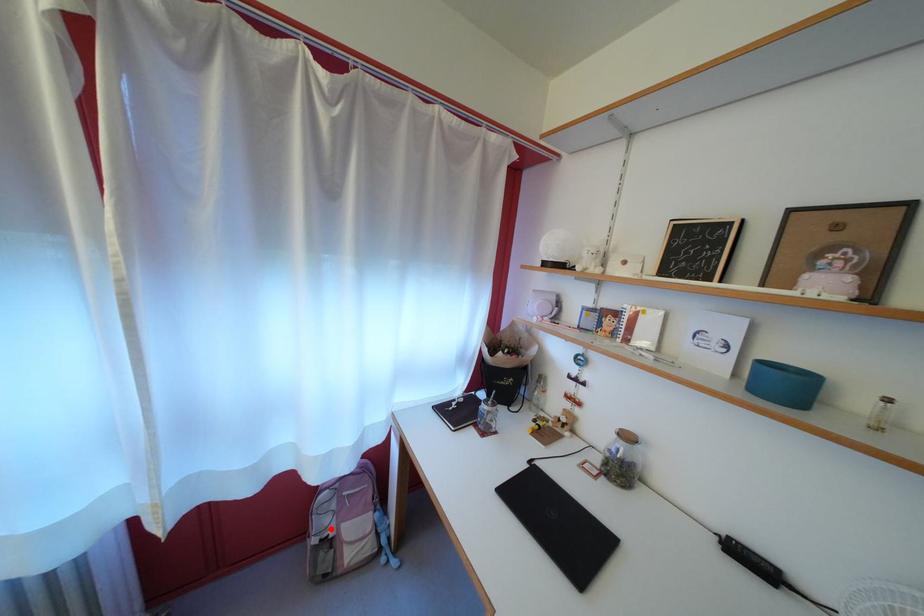
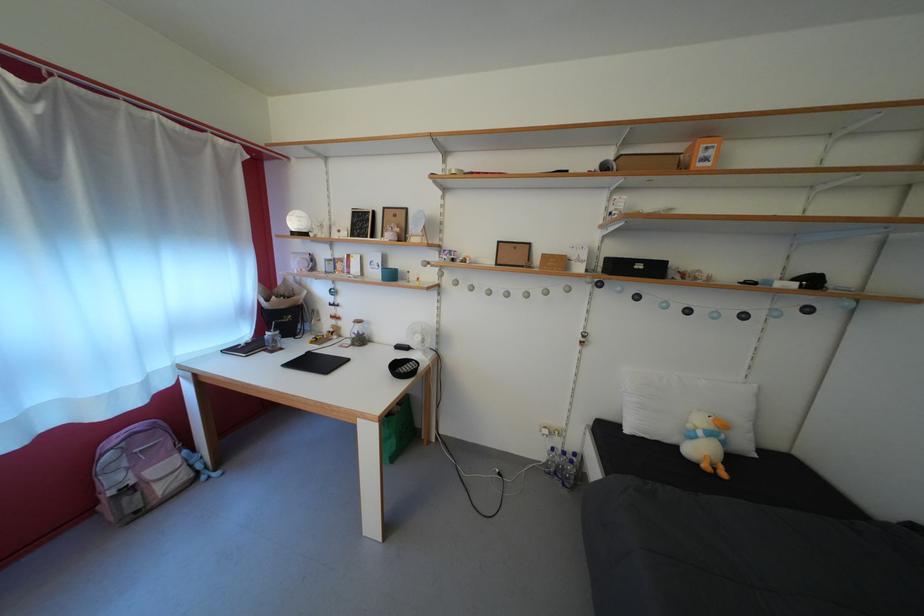
Question: I am providing you with two images of the same scene from different viewpoints. Image1 has a red point marked. In image2, the corresponding 3D location appears at what relative position? Reply with the corresponding letter.

Choices:
 (A) Closer
 (B) Farther

Answer: (B)